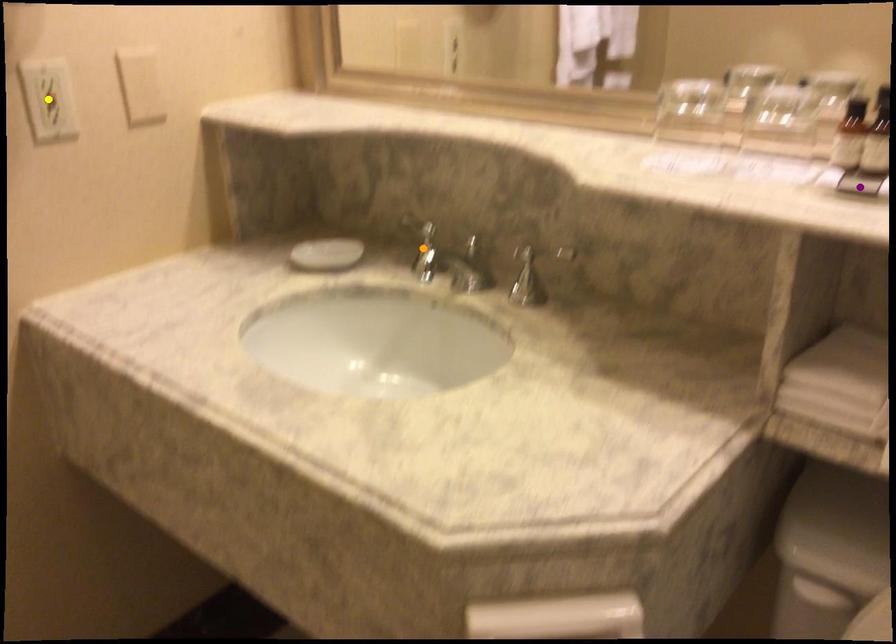
Order these from nearest to farthest:
A) yellow point
B) orange point
C) purple point

1. purple point
2. yellow point
3. orange point